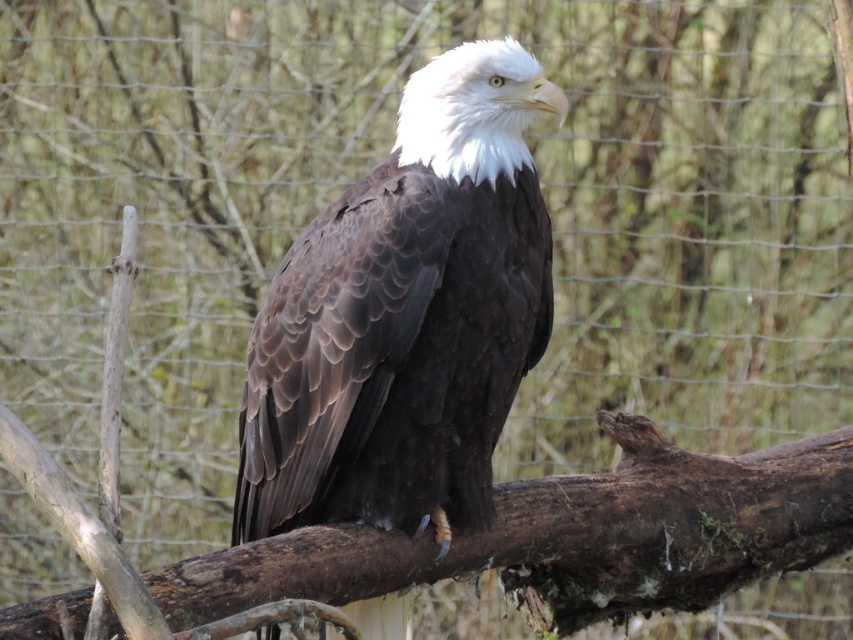
Can you confirm if dark brown feathers at center is shorter than brown rough wood at center?

No, dark brown feathers at center is not shorter than brown rough wood at center.

Which is below, dark brown feathers at center or brown rough wood at center?

brown rough wood at center

Is point (495, 340) in front of point (511, 513)?

Yes, it is.

Where is `dark brown feathers at center`? Image resolution: width=853 pixels, height=640 pixels. dark brown feathers at center is located at coordinates (405, 316).